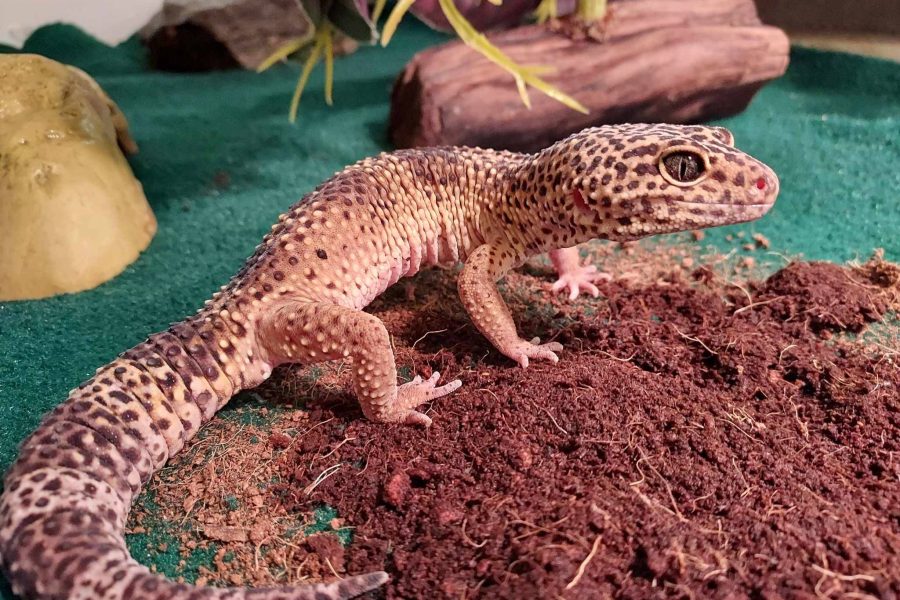
Identify the location of right front leg. The image size is (900, 600). (491, 312).